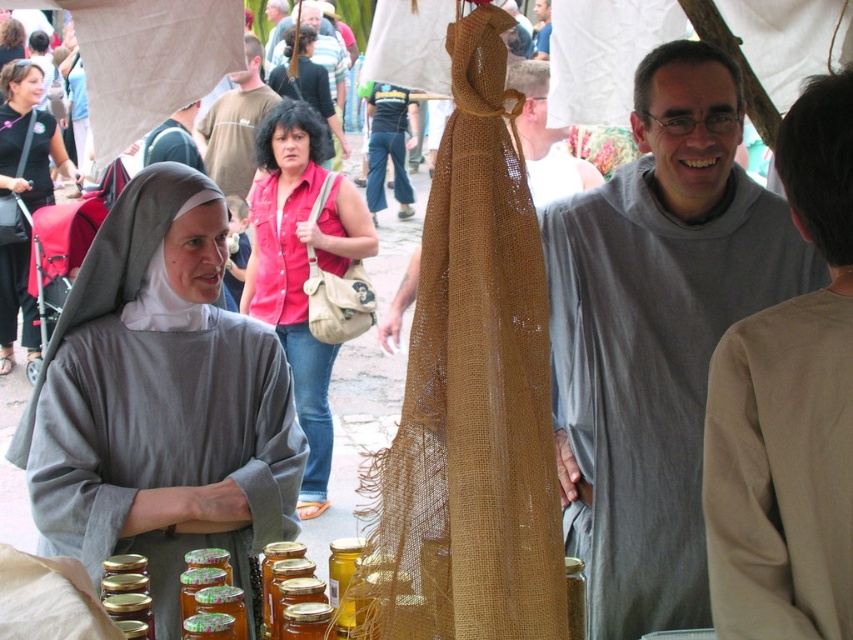
You are standing at the entrance of the market and see the two individuals in religious attire and the burlap sack between them. If you walk towards the point marked at coordinates (656,333), which object will you be approaching?

The point at coordinates (656,333) marks the gray woolen robe at center, so you will be approaching the gray woolen robe at center.

You are a customer at the market and want to buy a jar of honey. The jars are placed on a table between the gray woolen robe at center and the matte black dress at left. Which direction should you walk to reach the table where the jars are displayed?

The jars are displayed on the table between the gray woolen robe at center and the matte black dress at left. Since the gray woolen robe at center is smaller than the matte black dress at left, you should walk towards the smaller object to reach the table with the jars.

You are a photographer standing at the edge of the market, wanting to capture a photo of both the gray woolen robe at center and the matte black dress at left in the same frame. Given the camera you have can only focus on objects within 10 meters of each other, will you be able to include both in a single focused shot?

The distance between the gray woolen robe at center and the matte black dress at left is 9.06 meters, which is within the camera focus range of 10 meters. Therefore, both can be captured in a single focused shot.